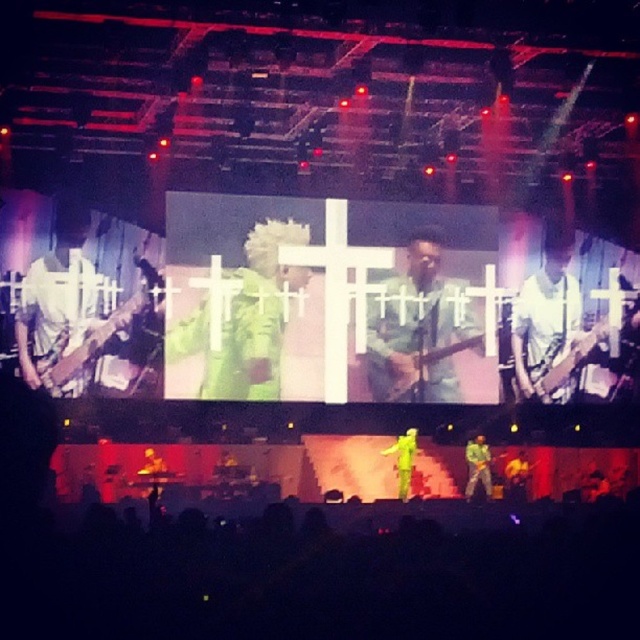
This screenshot has width=640, height=640. I want to click on green fabric guitar at center, so click(547, 320).

Which is in front, point (554, 340) or point (528, 465)?

Point (528, 465)

Between point (576, 324) and point (520, 480), which one is positioned behind?

Positioned behind is point (576, 324).

Identify the location of green fabric guitar at center. (547, 320).

Based on the photo, is green fuzzy coat at center smaller than green matte guitar at center?

Incorrect, green fuzzy coat at center is not smaller in size than green matte guitar at center.

Is point (168, 346) in front of point (486, 486)?

That is True.

Does point (250, 387) come farther from viewer compared to point (468, 490)?

Yes, point (250, 387) is farther from viewer.

The image size is (640, 640). In order to click on green fuzzy coat at center in this screenshot , I will do `click(244, 317)`.

Which is below, white matte guitar at left or green fabric guitar at center?

green fabric guitar at center is below.

Between point (77, 340) and point (576, 308), which one is positioned in front?

Point (77, 340)

From the picture: Who is more distant from viewer, [80,228] or [557,323]?

Point [557,323]

The width and height of the screenshot is (640, 640). Identify the location of white matte guitar at left. (61, 308).